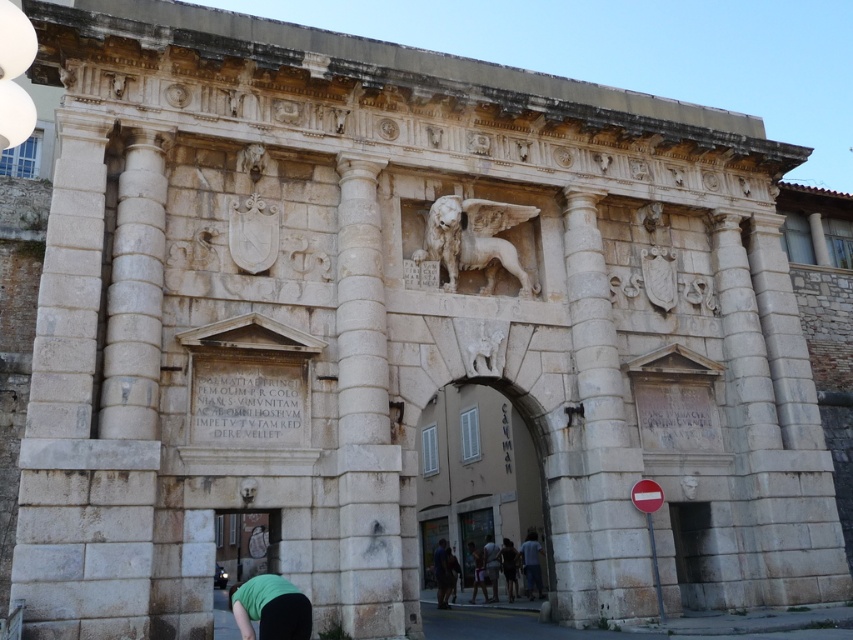
Who is positioned more to the left, white stone column at center or dark green fabric at center?

white stone column at center

Which is below, white stone column at center or dark green fabric at center?

dark green fabric at center is below.

Is point (341, 262) less distant than point (511, 580)?

Yes, it is.

Where is `white stone column at center`? white stone column at center is located at coordinates (364, 413).

Can you confirm if dark green fabric at center is positioned to the left of green fabric shirt at center?

No, dark green fabric at center is not to the left of green fabric shirt at center.

Find the location of a particular element. The image size is (853, 640). dark green fabric at center is located at coordinates (509, 566).

The height and width of the screenshot is (640, 853). Identify the location of dark green fabric at center. (509, 566).

Is stone archway at center smaller than green fabric person at lower center?

Actually, stone archway at center might be larger than green fabric person at lower center.

Is point (471, 538) behind point (447, 586)?

Yes, it is behind point (447, 586).

The height and width of the screenshot is (640, 853). Identify the location of stone archway at center. (473, 536).